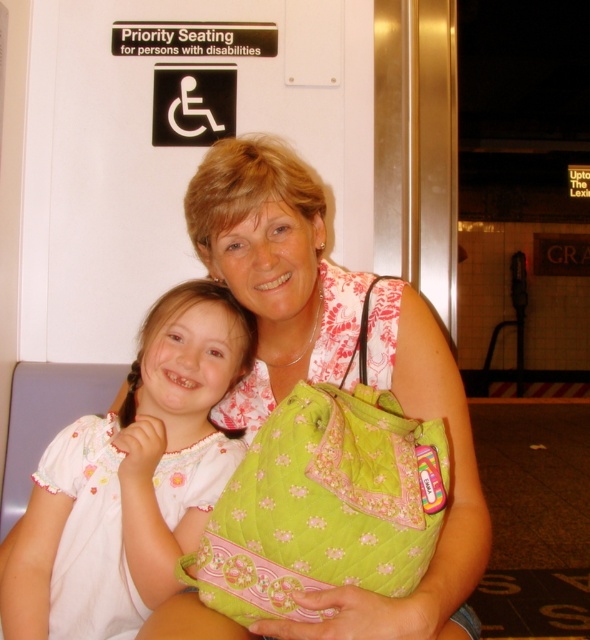
Can you confirm if white embroidered dress at center is bigger than green quilted shoulder bag at center?

No.

Locate an element on the screen. This screenshot has width=590, height=640. white embroidered dress at center is located at coordinates (132, 477).